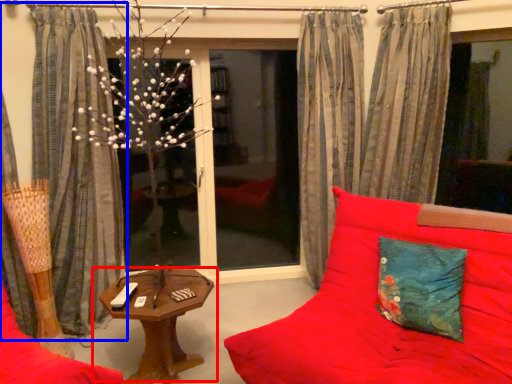
Question: Which point is closer to the camera, table (highlighted by a red box) or curtain (highlighted by a blue box)?

Choices:
 (A) table
 (B) curtain

Answer: (A)